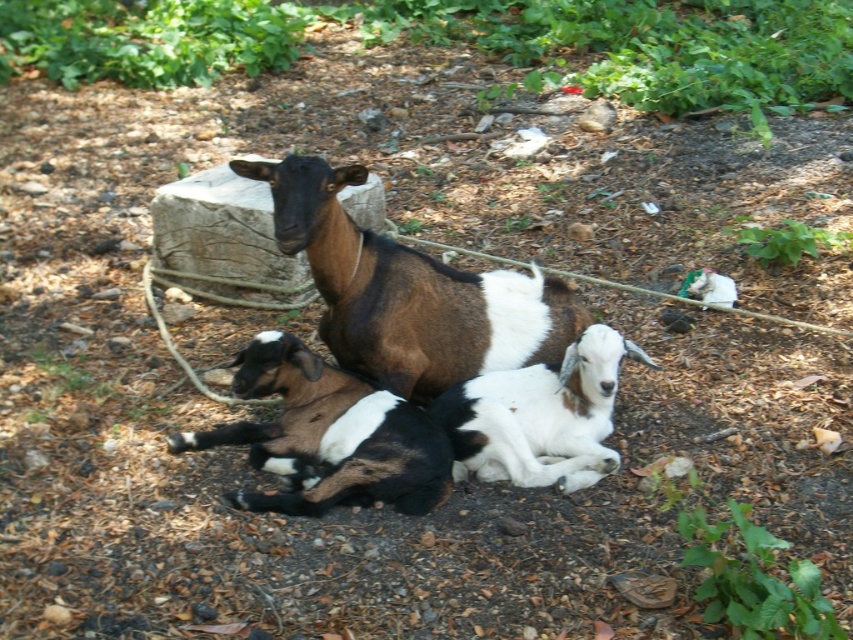
Question: Which is nearer to the white soft fur goat at center?

Choices:
 (A) brown/white fur goat at center
 (B) black and white fur at center

Answer: (B)

Question: Among these objects, which one is nearest to the camera?

Choices:
 (A) white soft fur goat at center
 (B) black and white fur at center

Answer: (B)

Question: Is the position of brown/white fur goat at center more distant than that of white soft fur goat at center?

Choices:
 (A) no
 (B) yes

Answer: (A)

Question: Which of the following is the closest to the observer?

Choices:
 (A) white soft fur goat at center
 (B) brown/white fur goat at center
 (C) black and white fur at center

Answer: (B)

Question: From the image, what is the correct spatial relationship of brown/white fur goat at center in relation to white soft fur goat at center?

Choices:
 (A) right
 (B) left

Answer: (B)

Question: Is brown/white fur goat at center wider than black and white fur at center?

Choices:
 (A) no
 (B) yes

Answer: (B)